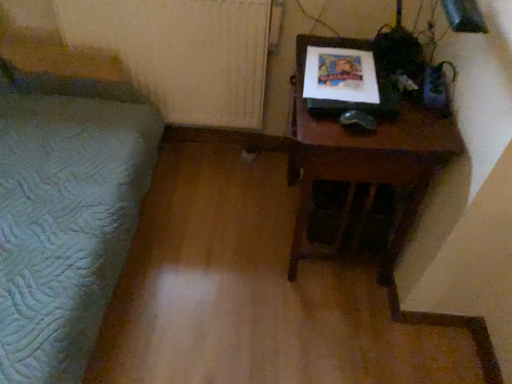
Locate an element on the screen. The image size is (512, 384). vacant space in front of wooden table at right is located at coordinates (325, 333).